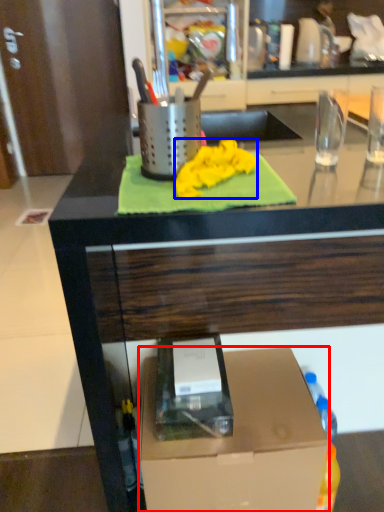
Question: Which object appears closest to the camera in this image, box (highlighted by a red box) or cloth (highlighted by a blue box)?

Choices:
 (A) box
 (B) cloth

Answer: (B)